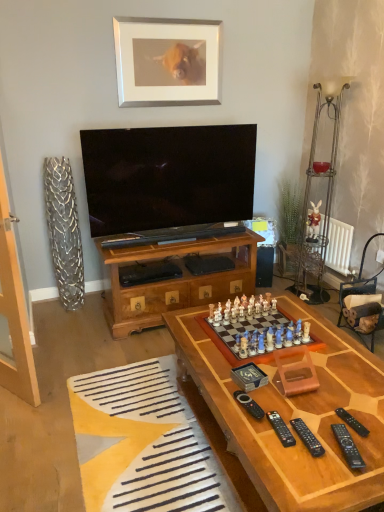
At what (x,y) coordinates should I click in order to perform the action: click on vacant space that's between black plastic remote at lower right, the 4th remote in the right-to-left sequence, and black plastic remote at center, which appears as the first remote when viewed from the left. Please return your answer as a coordinate pair (x, y). The image size is (384, 512). Looking at the image, I should click on (262, 418).